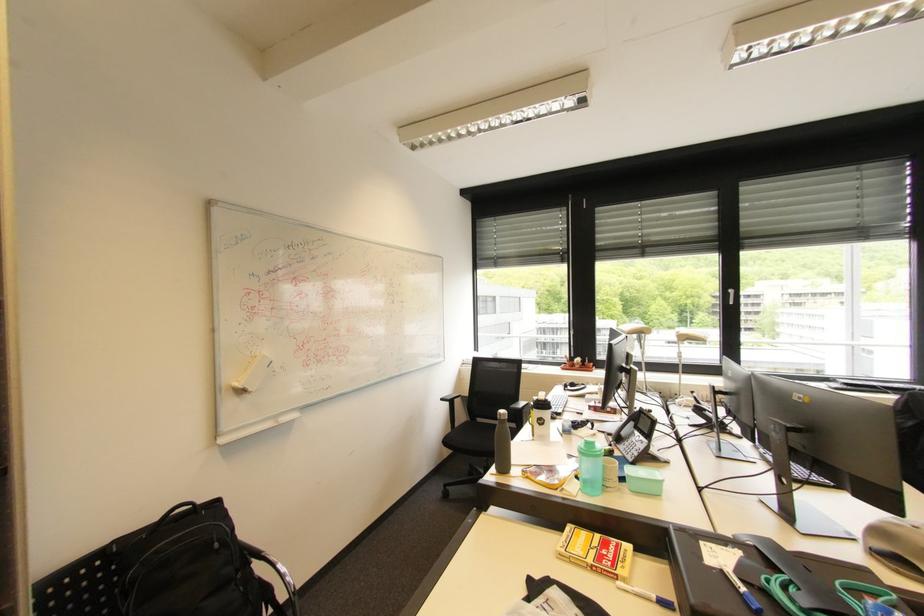
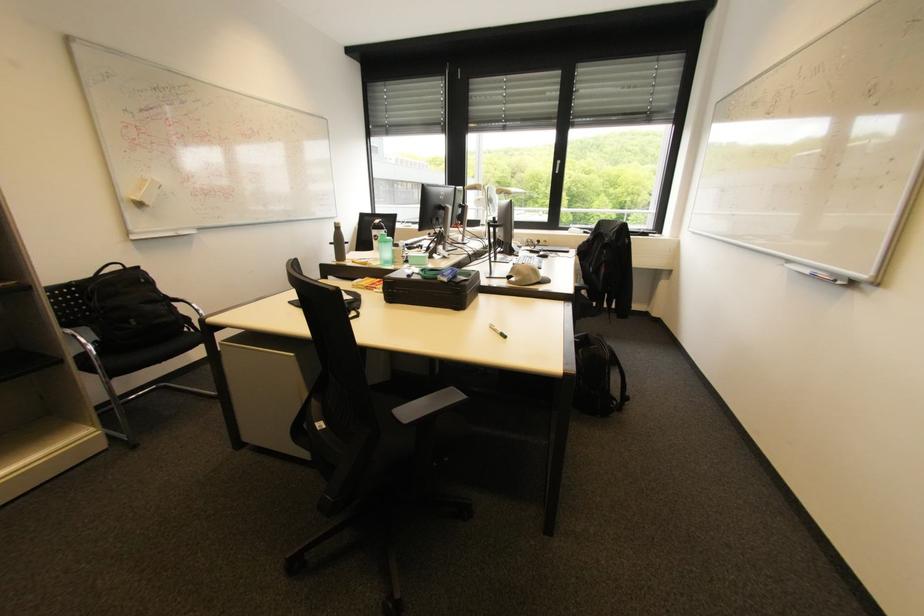
Locate, in the second image, the point that corresponds to (x=548, y=424) in the first image.

(382, 240)